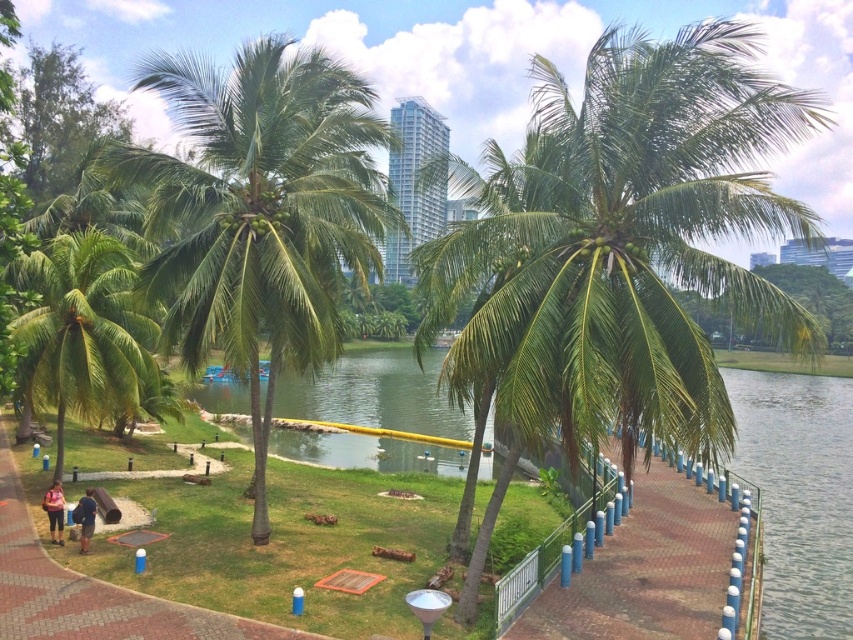
Question: Where is green leafy coconut tree at center located in relation to brick paved walkway at center in the image?

Choices:
 (A) below
 (B) above

Answer: (B)

Question: Can you confirm if brick paved walkway at center is positioned below green leafy palm tree at lower left?

Choices:
 (A) yes
 (B) no

Answer: (A)

Question: Which point is closer to the camera?

Choices:
 (A) (3, 598)
 (B) (677, 604)
 (C) (80, 529)
 (D) (764, 76)

Answer: (D)

Question: Which of the following is the farthest from the observer?

Choices:
 (A) (379, 256)
 (B) (49, 529)
 (C) (51, 563)
 (D) (42, 332)

Answer: (D)

Question: Is green leafy palm tree at lower left smaller than brown brick path at lower left?

Choices:
 (A) yes
 (B) no

Answer: (A)

Question: Which of the following is the farthest from the observer?

Choices:
 (A) 248,122
 (B) 717,536

Answer: (B)